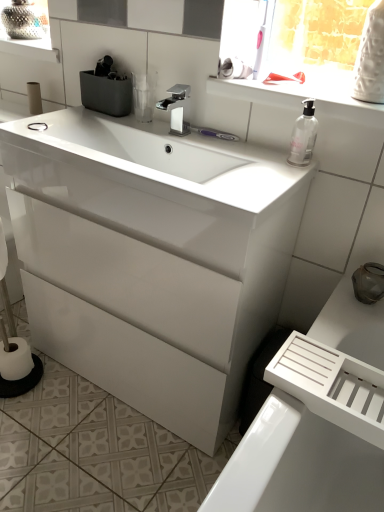
Where is `vacant space that's between clear glass soap dispenser at upper right and polished chrome faucet at center`? The height and width of the screenshot is (512, 384). vacant space that's between clear glass soap dispenser at upper right and polished chrome faucet at center is located at coordinates (232, 148).